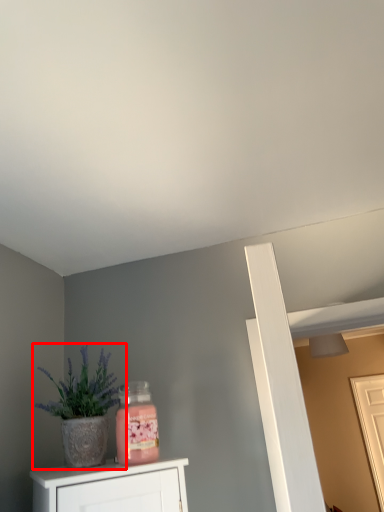
Question: In this image, where is houseplant (annotated by the red box) located relative to door?

Choices:
 (A) left
 (B) right

Answer: (A)